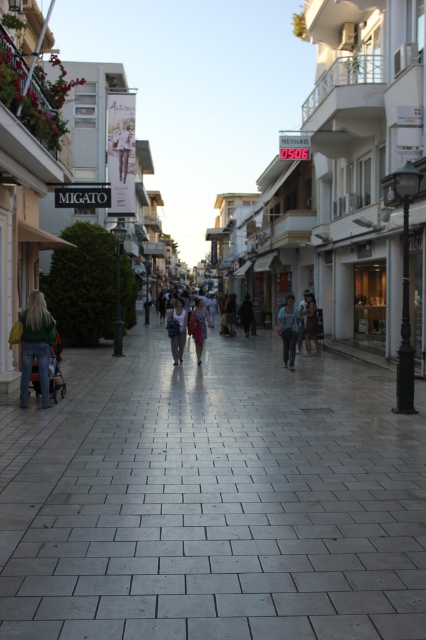
Question: Among these points, which one is farthest from the camera?

Choices:
 (A) click(x=178, y=323)
 (B) click(x=169, y=584)
 (C) click(x=189, y=330)

Answer: (C)

Question: Can you confirm if gray concrete pavement at center is thinner than dark blue jeans at center?

Choices:
 (A) yes
 (B) no

Answer: (B)

Question: Does white glossy mall at center lie in front of denim pants at center?

Choices:
 (A) yes
 (B) no

Answer: (A)

Question: Among these points, which one is nearest to the camera?

Choices:
 (A) tap(232, 474)
 (B) tap(181, 310)

Answer: (A)

Question: Is gray concrete pavement at center bigger than white glossy mall at center?

Choices:
 (A) yes
 (B) no

Answer: (B)

Question: Which object is the closest to the light blue jeans at center?

Choices:
 (A) dark blue jeans at center
 (B) dark gray coat at center

Answer: (A)